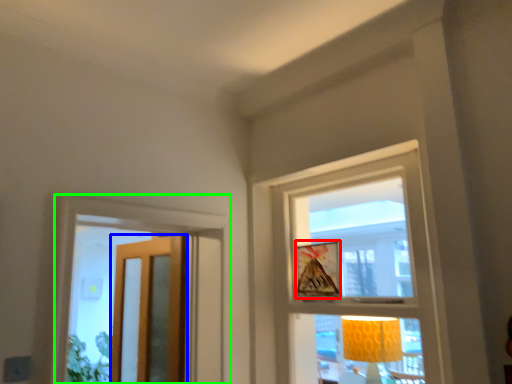
Question: Which object is positioned closest to picture frame (highlighted by a red box)? Select from door (highlighted by a blue box) and window (highlighted by a green box).

Choices:
 (A) door
 (B) window

Answer: (B)